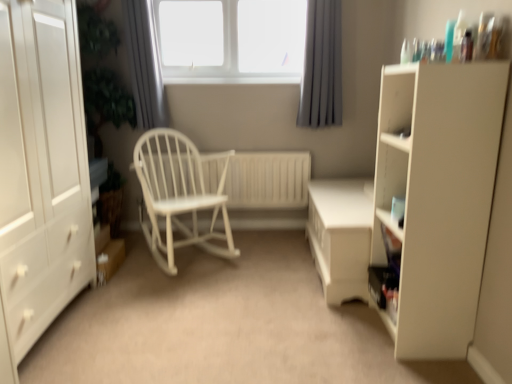
Find the location of a particular element. The width and height of the screenshot is (512, 384). free space between matte white cupboard at right and white glossy table at center is located at coordinates (354, 317).